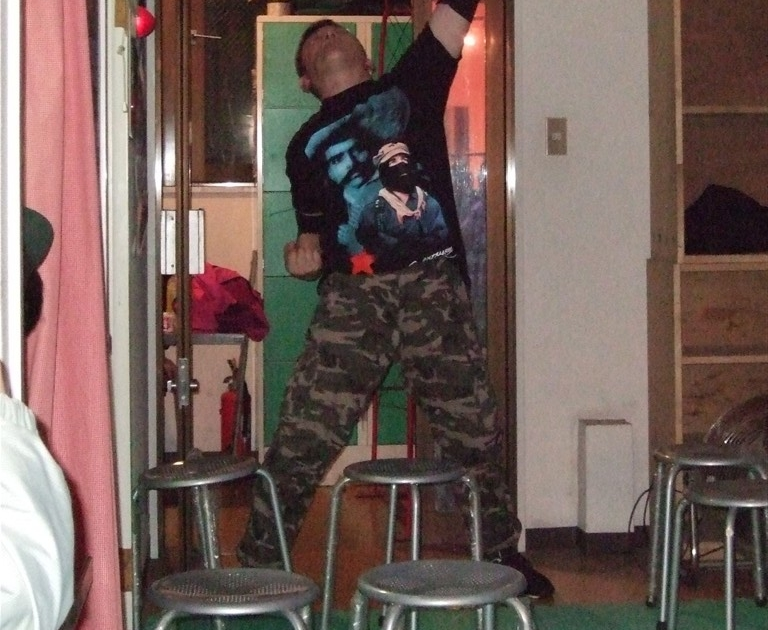
At what (x,y) coordinates should I click in order to perform the action: click on pink curtain. Please return your answer as a coordinate pair (x, y). Looking at the image, I should click on pos(74,317).